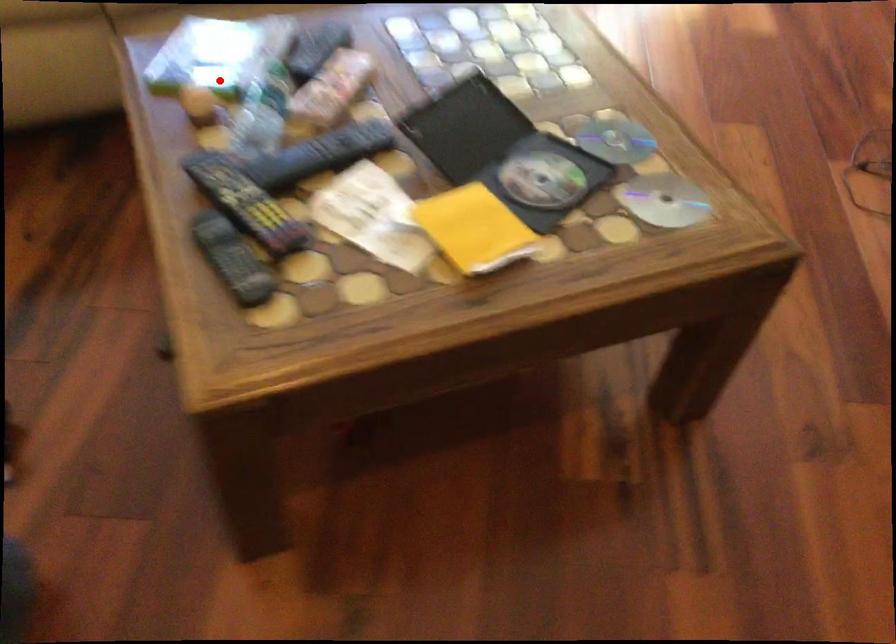
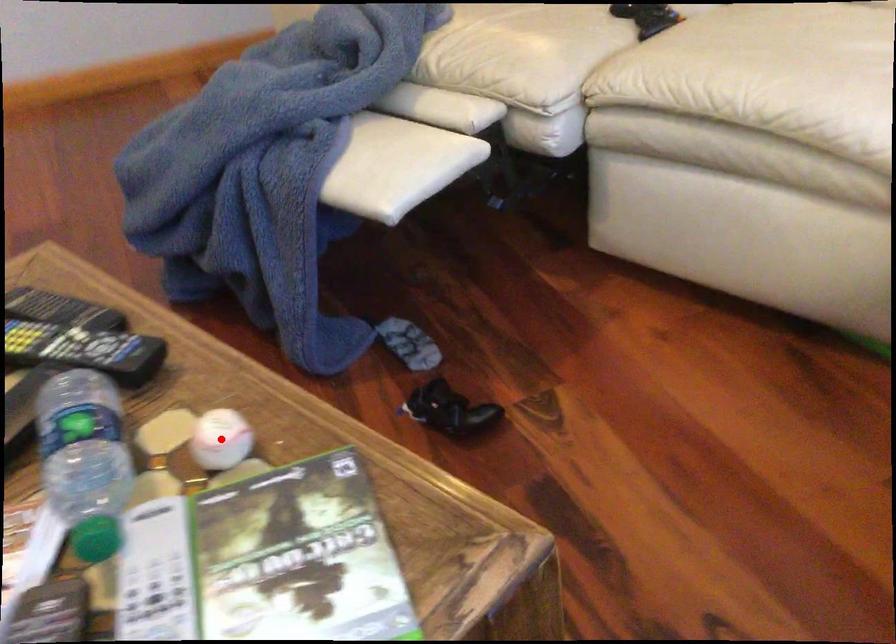
I am providing you with two images of the same scene from different viewpoints. A red point is marked on the first image and another point is marked on the second image. Is the red point in image1 aligned with the point shown in image2?

Yes